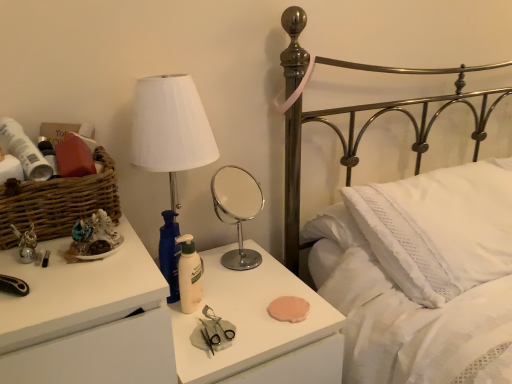
Where is `free space in front of white matte lotion at center`? Image resolution: width=512 pixels, height=384 pixels. free space in front of white matte lotion at center is located at coordinates (199, 346).